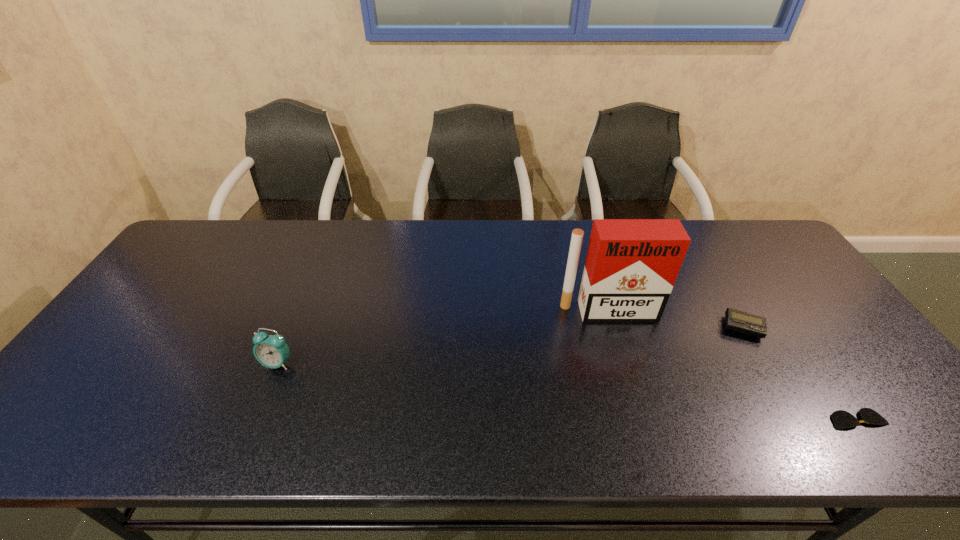
At what (x,y) coordinates should I click in order to perform the action: click on vacant space at the near left corner of the desktop. Please return your answer as a coordinate pair (x, y). Image resolution: width=960 pixels, height=540 pixels. Looking at the image, I should click on (88, 428).

The image size is (960, 540). Find the location of `vacant area at the far right corner of the desktop`. vacant area at the far right corner of the desktop is located at coordinates (732, 237).

Where is `vacant space that is in between the rightmost object and the alarm clock`? This screenshot has width=960, height=540. vacant space that is in between the rightmost object and the alarm clock is located at coordinates (567, 392).

Identify the location of unoccupied position between the third object from right to left and the shortest object. The height and width of the screenshot is (540, 960). (732, 365).

You are a GUI agent. You are given a task and a screenshot of the screen. Output one action in this format:
    pyautogui.click(x=<x>, y=<y>)
    Task: Click on the free space between the beeper and the second nearest object
    The image size is (960, 540).
    Given the screenshot: What is the action you would take?
    pyautogui.click(x=510, y=345)

Identify the location of unoccupied position between the third object from right to left and the third farthest object. (443, 337).

Find the location of a particular element. vacant space that is in between the beeper and the tallest object is located at coordinates (676, 319).

This screenshot has width=960, height=540. Find the location of `vacant space in between the shortest object and the third shortest object`. vacant space in between the shortest object and the third shortest object is located at coordinates (567, 392).

Find the location of a particular element. vacant area between the beeper and the third shortest object is located at coordinates (510, 345).

What are the coordinates of `free area in between the shortest object and the second object from left to right` in the screenshot? It's located at (732, 365).